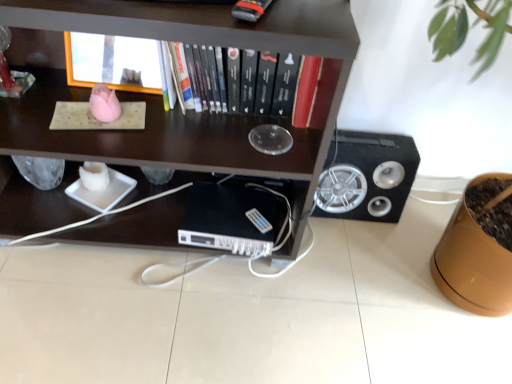
In order to click on free space between black matte speaker at right and dark wood shelf at upper center, arranged as the 2th shelf when viewed from the top in this screenshot , I will do `click(338, 241)`.